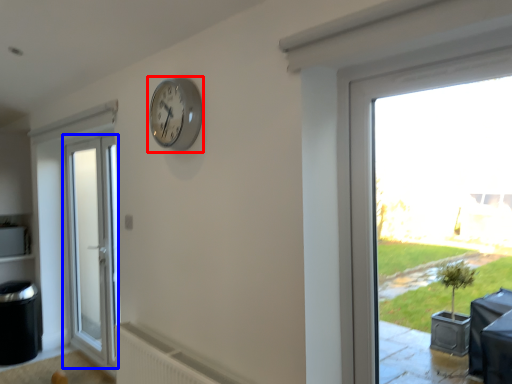
Question: Among these objects, which one is nearest to the camera, clock (highlighted by a red box) or door (highlighted by a blue box)?

Choices:
 (A) clock
 (B) door

Answer: (A)